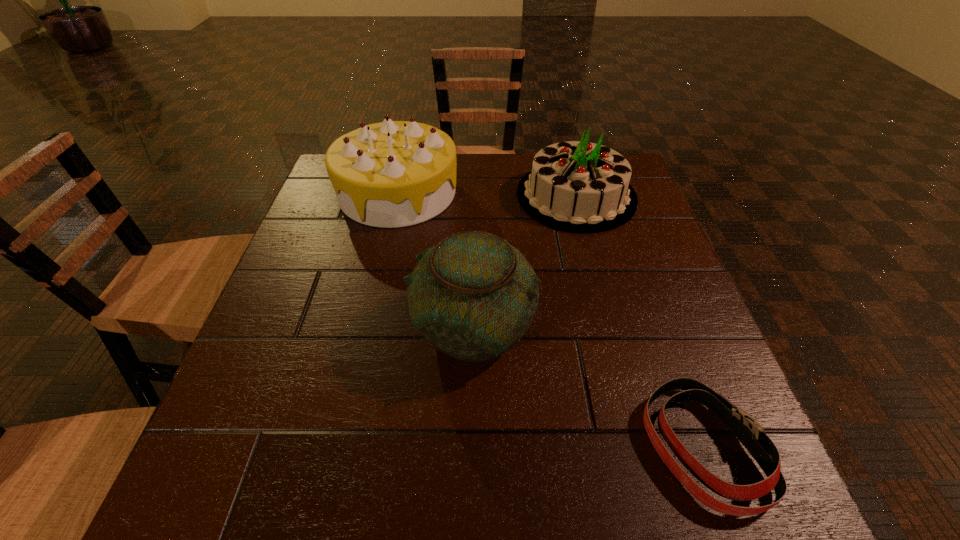
Where is `free location at the near left corner`? Image resolution: width=960 pixels, height=540 pixels. free location at the near left corner is located at coordinates (242, 488).

Where is `free space at the near right corner of the desktop`? The height and width of the screenshot is (540, 960). free space at the near right corner of the desktop is located at coordinates (x=768, y=512).

The image size is (960, 540). Find the location of `free space that is in between the nearest object and the left birthday cake`. free space that is in between the nearest object and the left birthday cake is located at coordinates (549, 320).

Where is `free space between the right birthday cake and the shortest object`? This screenshot has height=540, width=960. free space between the right birthday cake and the shortest object is located at coordinates (638, 321).

The image size is (960, 540). I want to click on vacant region between the dog collar and the right birthday cake, so click(638, 321).

The width and height of the screenshot is (960, 540). What are the coordinates of `vacant space that is in between the right birthday cake and the left birthday cake` in the screenshot? It's located at (487, 194).

At what (x,y) coordinates should I click in order to perform the action: click on vacant area that lies between the second nearest object and the nearest object. Please return your answer as a coordinate pair (x, y). Looking at the image, I should click on (587, 388).

Find the location of a particular element. This screenshot has height=540, width=960. free spot between the right birthday cake and the left birthday cake is located at coordinates (487, 194).

Where is `unoccupied position between the shortest object and the right birthday cake`? This screenshot has width=960, height=540. unoccupied position between the shortest object and the right birthday cake is located at coordinates [x=638, y=321].

Identify the location of vacant space that's between the left birthday cake and the shortest object. 549,320.